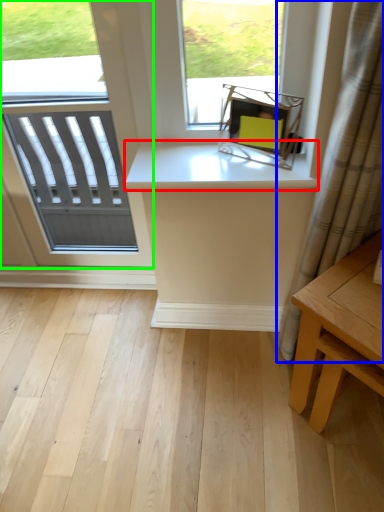
Question: Considering the real-world distances, which object is farthest from counter top (highlighted by a red box)? curtain (highlighted by a blue box) or window (highlighted by a green box)?

Choices:
 (A) curtain
 (B) window

Answer: (B)